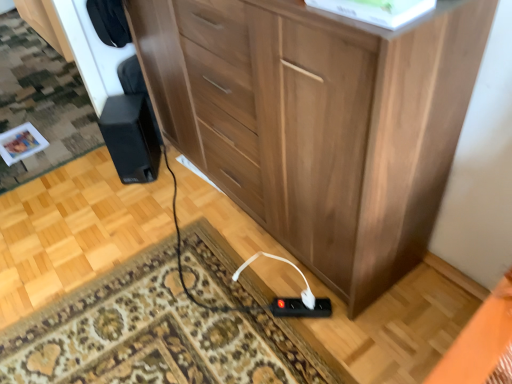
Identify the location of vacant space to the right of black matte speaker at lower left. The image size is (512, 384). (177, 172).